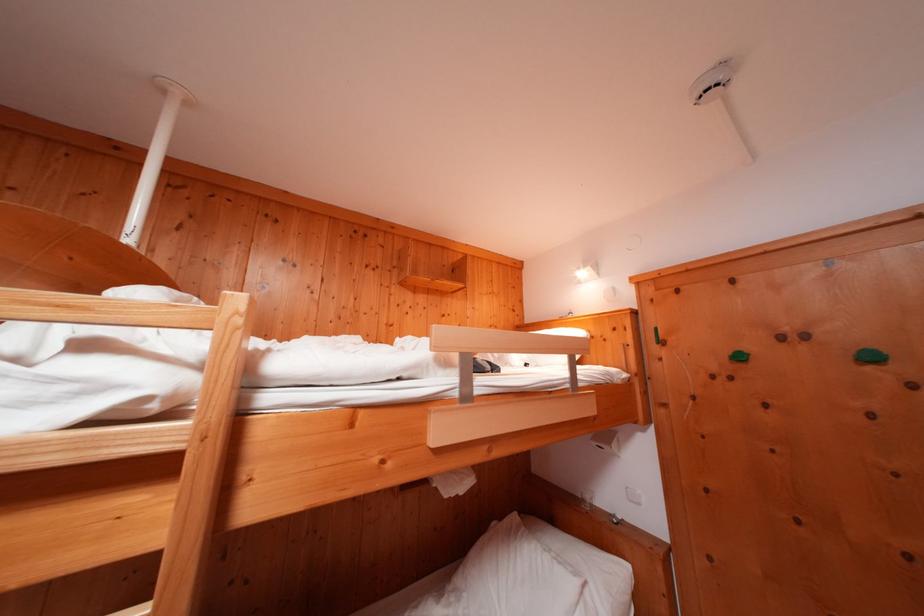
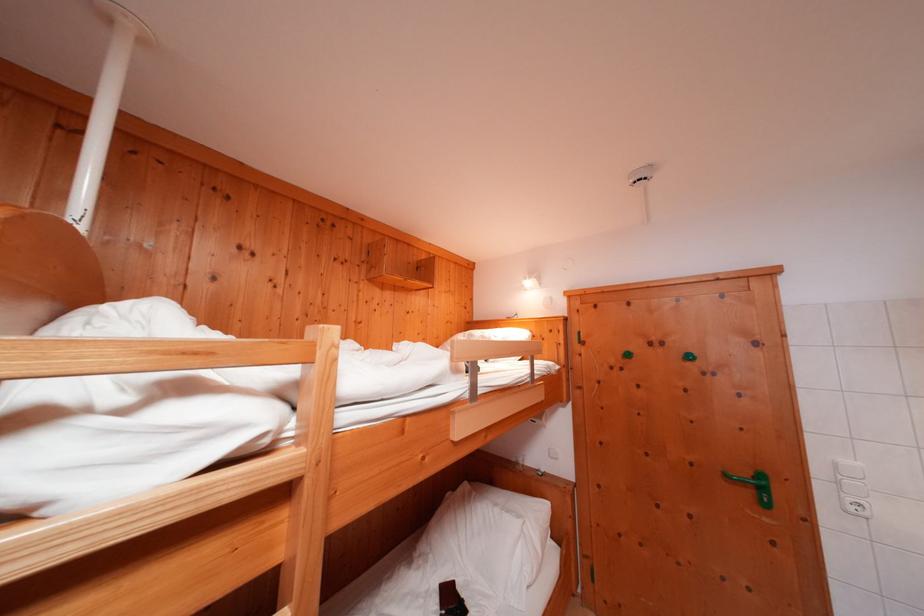
Question: The first image is from the beginning of the video and the second image is from the end. How did the camera likely rotate when shooting the video?

Choices:
 (A) Left
 (B) Right
 (C) Up
 (D) Down

Answer: (B)